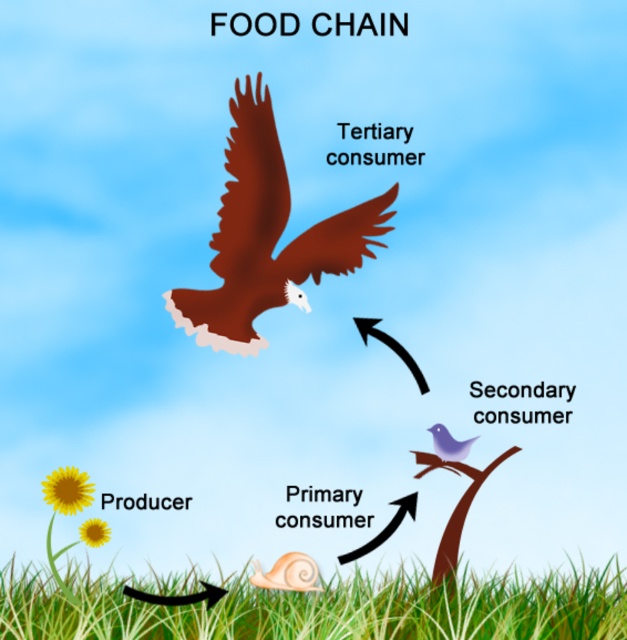
Based on the scene description, which object is shorter between the green grass at lower center and the brown matte eagle at upper center?

The green grass at lower center is shorter than the brown matte eagle at upper center.

You are standing in the food chain diagram and want to move from the green grass at lower center to the purple matte bird at upper center. Which direction should you move?

You should move to the right because the green grass at lower center is to the left of the purple matte bird at upper center.

Is the green grass at lower center wider than the purple matte bird at upper center?

The green grass at lower center is wider than the purple matte bird at upper center according to the description.